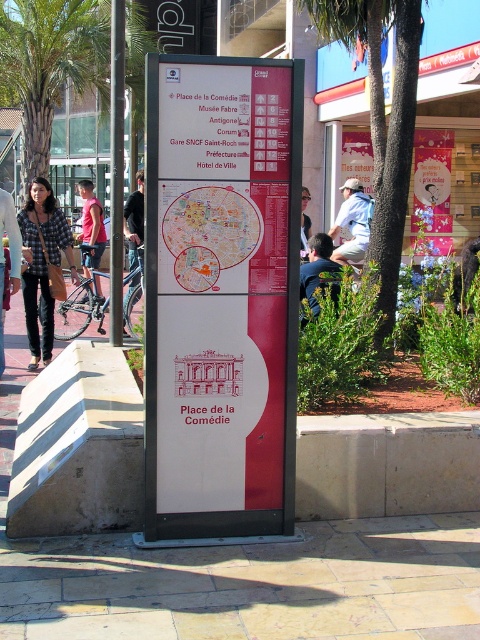
Who is more forward, [2,275] or [301,250]?

Point [2,275] is more forward.

I want to click on denim jacket at left, so click(x=10, y=256).

Between point (31, 307) and point (130, 308), which one is positioned behind?

The point (130, 308) is behind.

The height and width of the screenshot is (640, 480). What do you see at coordinates (43, 266) in the screenshot? I see `checkered fabric shirt at left` at bounding box center [43, 266].

Where is `checkered fabric shirt at left`? The image size is (480, 640). checkered fabric shirt at left is located at coordinates (43, 266).

Who is shorter, checkered fabric shirt at left or red shirt at left?

With less height is red shirt at left.

Does checkered fabric shirt at left have a lesser width compared to red shirt at left?

Yes.

At what (x,y) coordinates should I click in order to perform the action: click on checkered fabric shirt at left. Please return your answer as a coordinate pair (x, y). The width and height of the screenshot is (480, 640). Looking at the image, I should click on (43, 266).